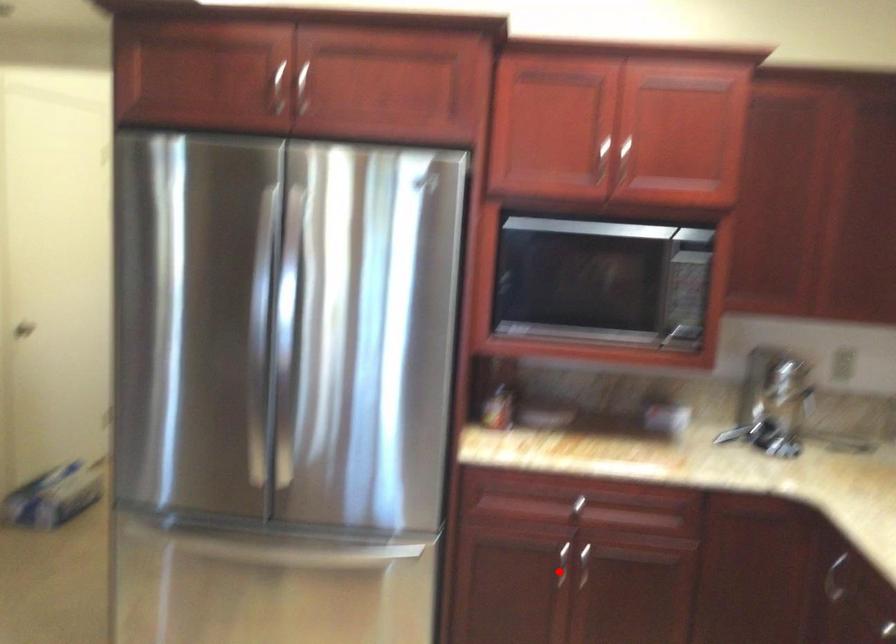
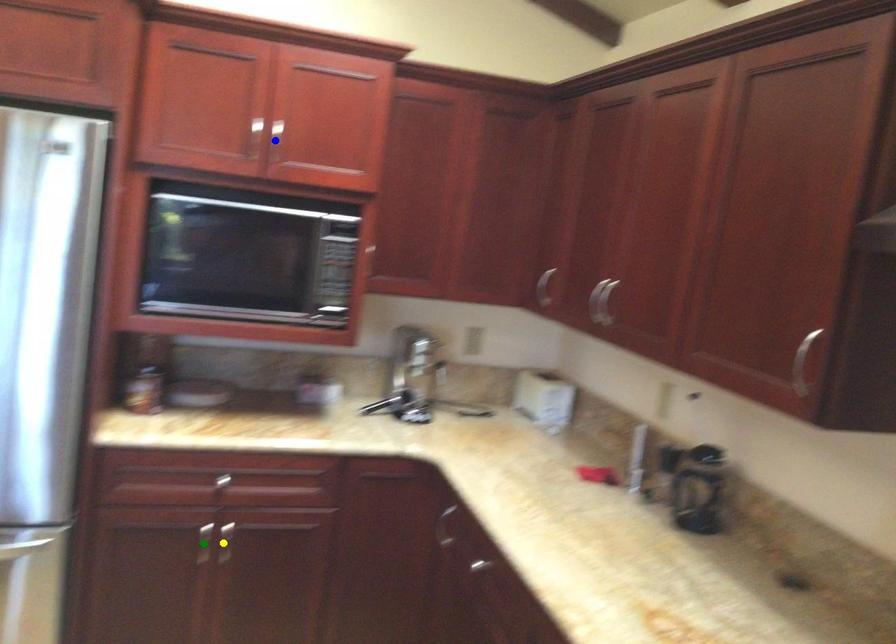
Question: I am providing you with two images of the same scene from different viewpoints. A red point is marked on the first image. You are given multiple points on the second image. In image 2, which mark is for the same physical point as the one in image 1?

Choices:
 (A) green point
 (B) blue point
 (C) yellow point

Answer: (A)